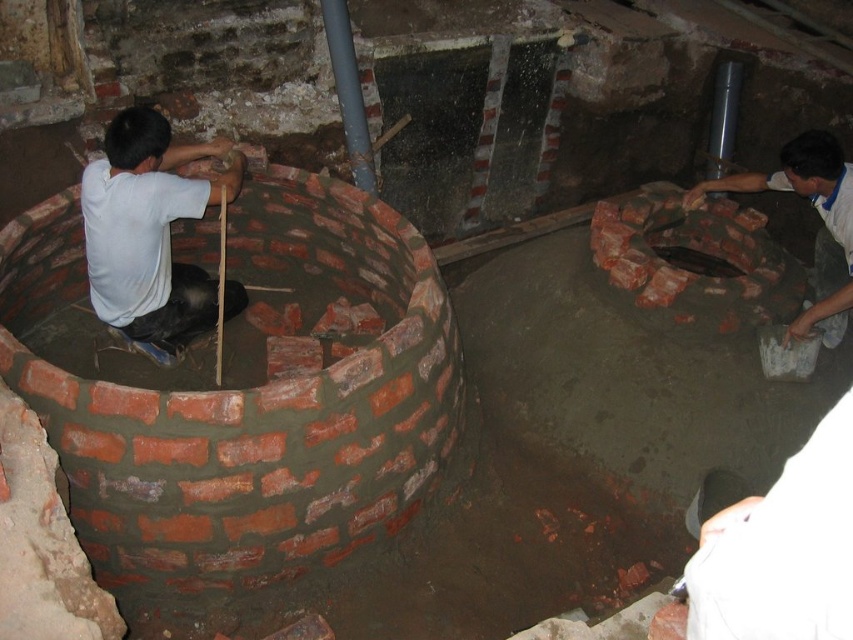
You are standing in the construction area and want to reach both points. Which point, point (108, 285) or point (833, 296), is closer to you?

Point (108, 285) is closer to the viewer than point (833, 296).